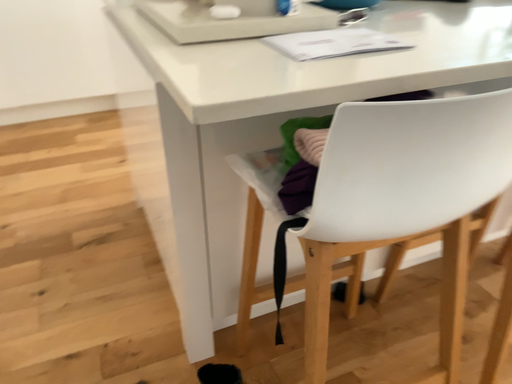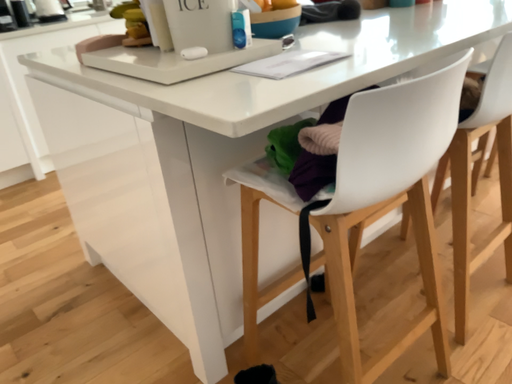
Question: How did the camera likely rotate when shooting the video?

Choices:
 (A) rotated left
 (B) rotated right

Answer: (B)